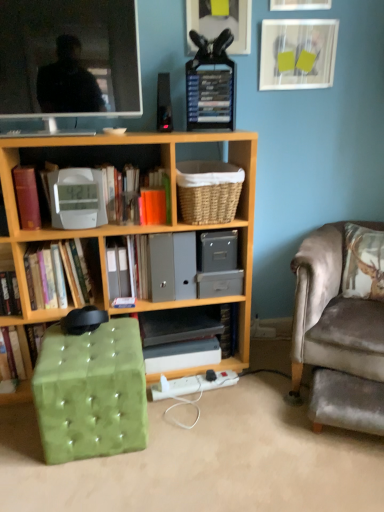
The image size is (384, 512). Identify the location of free space above white plastic charger at lower center (from a real-world perspective). (190, 378).